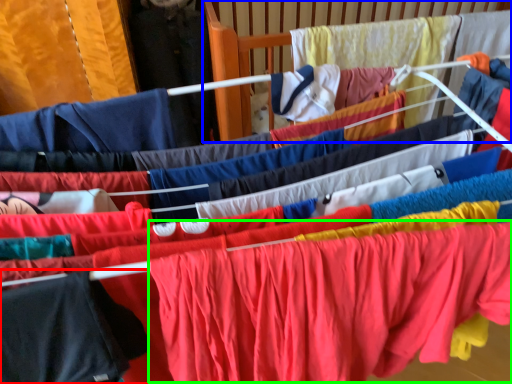
Question: Considering the real-world distances, which object is closest to clothing (highlighted by a red box)? infant bed (highlighted by a blue box) or clothing (highlighted by a green box).

Choices:
 (A) infant bed
 (B) clothing

Answer: (B)